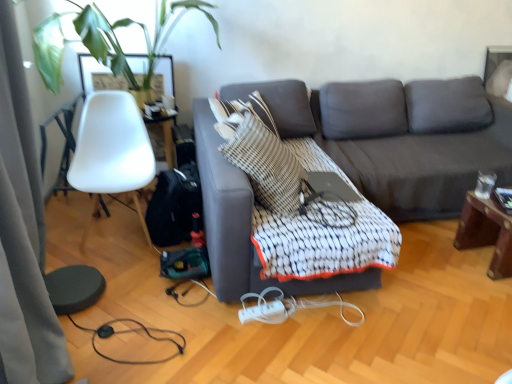
Locate an element on the screen. This screenshot has width=512, height=384. vacant area that lies to the right of white plastic cable at lower center, positioned as the first cable in right-to-left order is located at coordinates (383, 329).